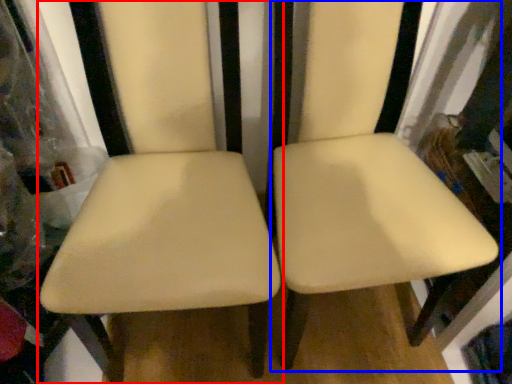
Question: Which point is further to the camera, chair (highlighted by a red box) or chair (highlighted by a blue box)?

Choices:
 (A) chair
 (B) chair

Answer: (B)